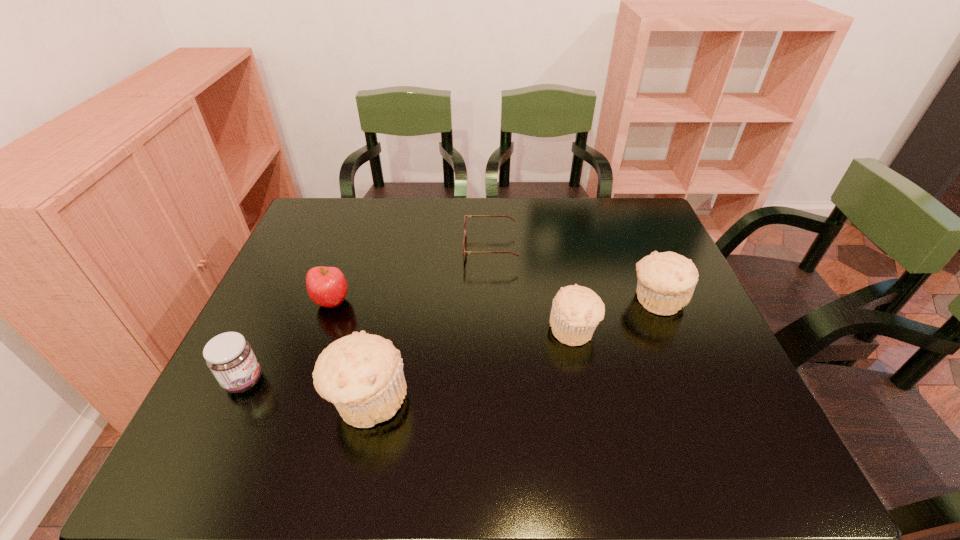
To achieve uniform spacing by inserting another muffin among them, please point to a free space for this new muffin. Please provide its 2D coordinates. Your answer should be formatted as a tuple, i.e. [(x, y)], where the tuple contains the x and y coordinates of a point satisfying the conditions above.

[(478, 362)]